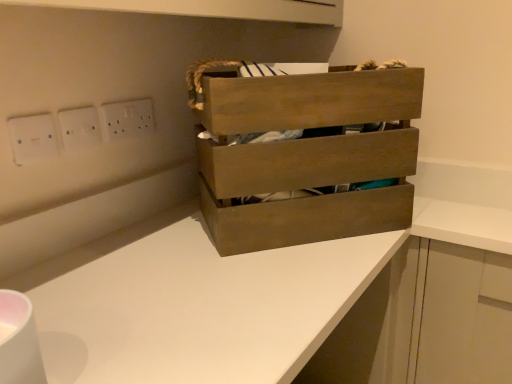
The width and height of the screenshot is (512, 384). In order to click on white plastic electric outlet at upper center, the third electric outlet from the left in this screenshot , I will do `click(128, 119)`.

The width and height of the screenshot is (512, 384). What do you see at coordinates (296, 290) in the screenshot? I see `white matte counter at center` at bounding box center [296, 290].

At what (x,y) coordinates should I click in order to perform the action: click on wooden crate at center. Please return your answer as a coordinate pair (x, y). Looking at the image, I should click on (308, 156).

This screenshot has height=384, width=512. I want to click on white plastic electric outlet at upper center, the third electric outlet from the left, so click(x=128, y=119).

Considering the positions of objects white matte counter at center and wooden crate at center in the image provided, who is more to the right, white matte counter at center or wooden crate at center?

From the viewer's perspective, wooden crate at center appears more on the right side.

Considering the relative sizes of white matte counter at center and wooden crate at center in the image provided, is white matte counter at center smaller than wooden crate at center?

Incorrect, white matte counter at center is not smaller in size than wooden crate at center.

Is white matte counter at center aimed at wooden crate at center?

No, white matte counter at center is not facing towards wooden crate at center.

Does white plastic socket at upper left, arranged as the 2th electric outlet when viewed from the left, have a lesser width compared to white matte counter at center?

Correct, the width of white plastic socket at upper left, arranged as the 2th electric outlet when viewed from the left, is less than that of white matte counter at center.

Does point (79, 130) lie behind point (224, 305)?

Yes, point (79, 130) is farther from viewer.

Considering the relative sizes of white plastic socket at upper left, positioned as the 2th electric outlet in back-to-front order, and white matte counter at center in the image provided, is white plastic socket at upper left, positioned as the 2th electric outlet in back-to-front order, bigger than white matte counter at center?

Actually, white plastic socket at upper left, positioned as the 2th electric outlet in back-to-front order, might be smaller than white matte counter at center.

Where is `the 2nd electric outlet counting from the left side of the white matte counter at center`? The height and width of the screenshot is (384, 512). the 2nd electric outlet counting from the left side of the white matte counter at center is located at coordinates (79, 128).

Can you tell me how much white plastic socket at upper left, positioned as the 2th electric outlet in back-to-front order, and white plastic electrical outlet at upper left, which is counted as the third electric outlet, starting from the right, differ in facing direction?

white plastic socket at upper left, positioned as the 2th electric outlet in back-to-front order, and white plastic electrical outlet at upper left, which is counted as the third electric outlet, starting from the right, are facing 0.00148 degrees away from each other.

Between white plastic socket at upper left, placed as the second electric outlet when sorted from right to left, and white plastic electrical outlet at upper left, arranged as the 3th electric outlet when viewed from the back, which one has more height?

white plastic electrical outlet at upper left, arranged as the 3th electric outlet when viewed from the back, is taller.

Is white plastic socket at upper left, arranged as the 2th electric outlet when viewed from the left, at the left side of white plastic electrical outlet at upper left, arranged as the 3th electric outlet when viewed from the back?

In fact, white plastic socket at upper left, arranged as the 2th electric outlet when viewed from the left, is to the right of white plastic electrical outlet at upper left, arranged as the 3th electric outlet when viewed from the back.

From the image's perspective, is white plastic socket at upper left, arranged as the 2th electric outlet when viewed from the left, above or below white plastic electrical outlet at upper left, placed as the 1th electric outlet when sorted from front to back?

white plastic socket at upper left, arranged as the 2th electric outlet when viewed from the left, is above white plastic electrical outlet at upper left, placed as the 1th electric outlet when sorted from front to back.

From the image's perspective, between wooden crate at center and white matte counter at center, who is located below?

white matte counter at center.

Can you confirm if wooden crate at center is thinner than white matte counter at center?

Correct, the width of wooden crate at center is less than that of white matte counter at center.

Measure the distance from wooden crate at center to white matte counter at center.

The distance of wooden crate at center from white matte counter at center is 7.74 inches.

Is white matte counter at center aimed at white plastic electric outlet at upper center, the third electric outlet from the left?

No, white matte counter at center is not oriented towards white plastic electric outlet at upper center, the third electric outlet from the left.

Does white matte counter at center appear on the left side of white plastic electric outlet at upper center, the third electric outlet from the left?

No, white matte counter at center is not to the left of white plastic electric outlet at upper center, the third electric outlet from the left.

Considering the sizes of objects white matte counter at center and white plastic electric outlet at upper center, which is counted as the first electric outlet, starting from the right, in the image provided, who is shorter, white matte counter at center or white plastic electric outlet at upper center, which is counted as the first electric outlet, starting from the right,?

white plastic electric outlet at upper center, which is counted as the first electric outlet, starting from the right.

Locate an element on the screen. The height and width of the screenshot is (384, 512). counter in front of the white plastic electric outlet at upper center, the third electric outlet in the front-to-back sequence is located at coordinates (296, 290).

The image size is (512, 384). In order to click on electric outlet that is the 3rd one when counting upward from the white matte counter at center (from the image's perspective) in this screenshot , I will do `click(128, 119)`.

Considering the sizes of objects white plastic electric outlet at upper center, the third electric outlet in the front-to-back sequence, and white matte counter at center in the image provided, who is wider, white plastic electric outlet at upper center, the third electric outlet in the front-to-back sequence, or white matte counter at center?

white matte counter at center is wider.

In the scene shown: Which object is closer to the camera, white plastic electric outlet at upper center, the third electric outlet from the left, or white matte counter at center?

Positioned in front is white matte counter at center.

Can white matte counter at center be found inside white plastic electric outlet at upper center, the third electric outlet from the left?

No, white matte counter at center is located outside of white plastic electric outlet at upper center, the third electric outlet from the left.

Looking at this image, considering the relative positions of wooden crate at center and white plastic electrical outlet at upper left, placed as the first electric outlet when sorted from left to right, in the image provided, is wooden crate at center to the left of white plastic electrical outlet at upper left, placed as the first electric outlet when sorted from left to right, from the viewer's perspective?

No, wooden crate at center is not to the left of white plastic electrical outlet at upper left, placed as the first electric outlet when sorted from left to right.

Considering the sizes of objects wooden crate at center and white plastic electrical outlet at upper left, placed as the first electric outlet when sorted from left to right, in the image provided, who is thinner, wooden crate at center or white plastic electrical outlet at upper left, placed as the first electric outlet when sorted from left to right,?

white plastic electrical outlet at upper left, placed as the first electric outlet when sorted from left to right.

Is wooden crate at center bigger than white plastic electrical outlet at upper left, arranged as the 3th electric outlet when viewed from the back?

Yes.

From the picture: Does wooden crate at center turn towards white plastic electrical outlet at upper left, placed as the 1th electric outlet when sorted from front to back?

No, wooden crate at center is not facing towards white plastic electrical outlet at upper left, placed as the 1th electric outlet when sorted from front to back.

The width and height of the screenshot is (512, 384). I want to click on counter that appears on the left of wooden crate at center, so click(296, 290).

Locate an element on the screen. counter that appears below the white plastic socket at upper left, arranged as the 2th electric outlet when viewed from the left (from the image's perspective) is located at coordinates (296, 290).

Considering their positions, is white plastic socket at upper left, the second electric outlet from the front, positioned closer to white matte counter at center than white plastic electrical outlet at upper left, which is counted as the third electric outlet, starting from the right?

Based on the image, white plastic socket at upper left, the second electric outlet from the front, appears to be nearer to white matte counter at center.

When comparing their distances from white plastic electric outlet at upper center, which is counted as the first electric outlet, starting from the right, does white matte counter at center or wooden crate at center seem further?

white matte counter at center is further to white plastic electric outlet at upper center, which is counted as the first electric outlet, starting from the right.

Based on their spatial positions, is white plastic electrical outlet at upper left, placed as the first electric outlet when sorted from left to right, or wooden crate at center closer to white plastic socket at upper left, placed as the second electric outlet when sorted from right to left?

white plastic electrical outlet at upper left, placed as the first electric outlet when sorted from left to right, lies closer to white plastic socket at upper left, placed as the second electric outlet when sorted from right to left, than the other object.

Estimate the real-world distances between objects in this image. Which object is further from white plastic electric outlet at upper center, the third electric outlet from the left, white plastic electrical outlet at upper left, placed as the first electric outlet when sorted from left to right, or white matte counter at center?

Based on the image, white matte counter at center appears to be further to white plastic electric outlet at upper center, the third electric outlet from the left.

Looking at the image, which one is located closer to white matte counter at center, white plastic socket at upper left, the second electric outlet from the front, or white plastic electric outlet at upper center, the third electric outlet from the left?

white plastic electric outlet at upper center, the third electric outlet from the left, is closer to white matte counter at center.

Which object lies further to the anchor point white matte counter at center, white plastic socket at upper left, the second electric outlet from the front, or wooden crate at center?

white plastic socket at upper left, the second electric outlet from the front, is further to white matte counter at center.

Looking at the image, which one is located closer to wooden crate at center, white plastic socket at upper left, placed as the second electric outlet when sorted from right to left, or white plastic electric outlet at upper center, which is counted as the first electric outlet, starting from the right?

The object closer to wooden crate at center is white plastic electric outlet at upper center, which is counted as the first electric outlet, starting from the right.

When comparing their distances from white plastic socket at upper left, the second electric outlet from the front, does white plastic electric outlet at upper center, the third electric outlet from the left, or white plastic electrical outlet at upper left, arranged as the 3th electric outlet when viewed from the back, seem closer?

white plastic electrical outlet at upper left, arranged as the 3th electric outlet when viewed from the back, lies closer to white plastic socket at upper left, the second electric outlet from the front, than the other object.

Where is `chest of drawers between white plastic socket at upper left, placed as the second electric outlet when sorted from right to left, and white matte counter at center from top to bottom`? This screenshot has height=384, width=512. chest of drawers between white plastic socket at upper left, placed as the second electric outlet when sorted from right to left, and white matte counter at center from top to bottom is located at coordinates (308, 156).

You are a GUI agent. You are given a task and a screenshot of the screen. Output one action in this format:
    pyautogui.click(x=<x>, y=<y>)
    Task: Click on the electric outlet positioned between white plastic electrical outlet at upper left, arranged as the 3th electric outlet when viewed from the back, and white plastic electric outlet at upper center, the third electric outlet in the front-to-back sequence, from near to far
    The image size is (512, 384).
    Given the screenshot: What is the action you would take?
    pyautogui.click(x=79, y=128)

Find the location of a particular element. The image size is (512, 384). electric outlet between wooden crate at center and white matte counter at center from top to bottom is located at coordinates (32, 138).

The image size is (512, 384). What are the coordinates of `chest of drawers between white plastic electric outlet at upper center, positioned as the first electric outlet in back-to-front order, and white matte counter at center from top to bottom` in the screenshot? It's located at (308, 156).